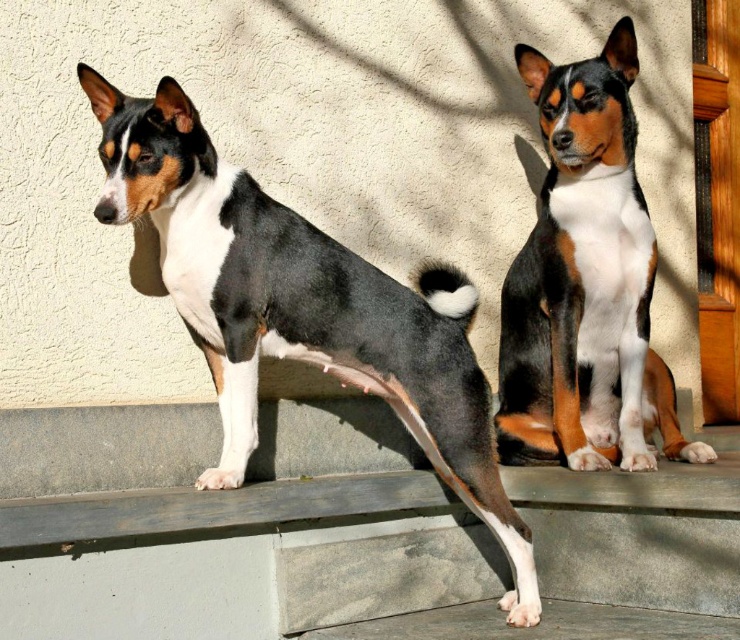
Question: Which of the following is the farthest from the observer?

Choices:
 (A) (598, 86)
 (B) (326, 243)

Answer: (A)

Question: Does black and white fur dog at center appear on the left side of tri-color fur dog at center?

Choices:
 (A) yes
 (B) no

Answer: (A)

Question: Which of the following is the farthest from the observer?

Choices:
 (A) black and white fur dog at center
 (B) tri-color fur dog at center

Answer: (B)

Question: Does black and white fur dog at center have a greater width compared to tri-color fur dog at center?

Choices:
 (A) no
 (B) yes

Answer: (B)

Question: Is black and white fur dog at center below tri-color fur dog at center?

Choices:
 (A) no
 (B) yes

Answer: (B)